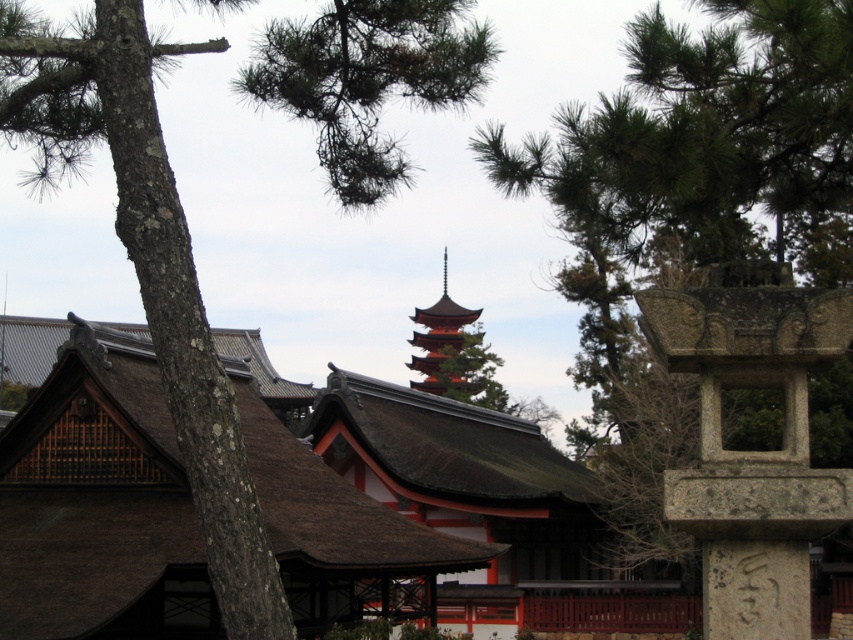
At what (x,y) coordinates should I click in order to perform the action: click on brown lichen-covered tree at upper left. Please return your answer as a coordinate pair (x, y). Looking at the image, I should click on (148, 262).

Is point (358, 1) less distant than point (445, 340)?

Yes, point (358, 1) is closer to viewer.

At what (x,y) coordinates should I click in order to perform the action: click on brown lichen-covered tree at upper left. Please return your answer as a coordinate pair (x, y). This screenshot has height=640, width=853. Looking at the image, I should click on (148, 262).

Is gray stone lantern at right bigger than red lacquered pagoda at center?

Incorrect, gray stone lantern at right is not larger than red lacquered pagoda at center.

Does gray stone lantern at right have a lesser width compared to red lacquered pagoda at center?

Yes, gray stone lantern at right is thinner than red lacquered pagoda at center.

Does point (737, 582) lie in front of point (416, 310)?

Yes, it is in front of point (416, 310).

Where is `gray stone lantern at right`? gray stone lantern at right is located at coordinates (752, 451).

Between point (415, 4) and point (751, 563), which one is positioned in front?

Point (751, 563) is more forward.

Can you confirm if brown lichen-covered tree at upper left is smaller than gray stone lantern at right?

Incorrect, brown lichen-covered tree at upper left is not smaller in size than gray stone lantern at right.

Where is `brown lichen-covered tree at upper left`? brown lichen-covered tree at upper left is located at coordinates 148,262.

Image resolution: width=853 pixels, height=640 pixels. In order to click on brown lichen-covered tree at upper left in this screenshot , I will do `click(148, 262)`.